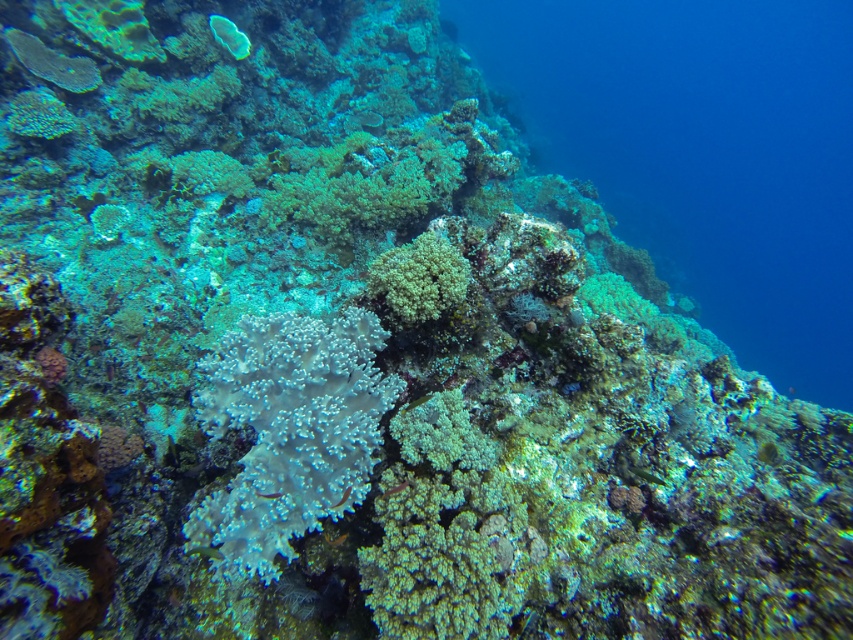
Question: Which point is farther from the camera taking this photo?

Choices:
 (A) (195, 554)
 (B) (445, 260)

Answer: (B)

Question: Can you confirm if white coral at upper left is smaller than translucent white coral at center?

Choices:
 (A) yes
 (B) no

Answer: (B)

Question: Based on their relative distances, which object is nearer to the translucent green coral at center?

Choices:
 (A) green soft coral at center
 (B) shiny green fish at center
 (C) clear blue water at center

Answer: (B)

Question: Can you confirm if green matte fish at lower center is positioned to the right of translucent white fish at center?

Choices:
 (A) no
 (B) yes

Answer: (B)

Question: Considering the real-world distances, which object is farthest from the white coral at upper left?

Choices:
 (A) shiny green fish at center
 (B) translucent yellow fish at center

Answer: (B)

Question: Does green soft coral at center have a lesser width compared to translucent white fish at center?

Choices:
 (A) yes
 (B) no

Answer: (B)